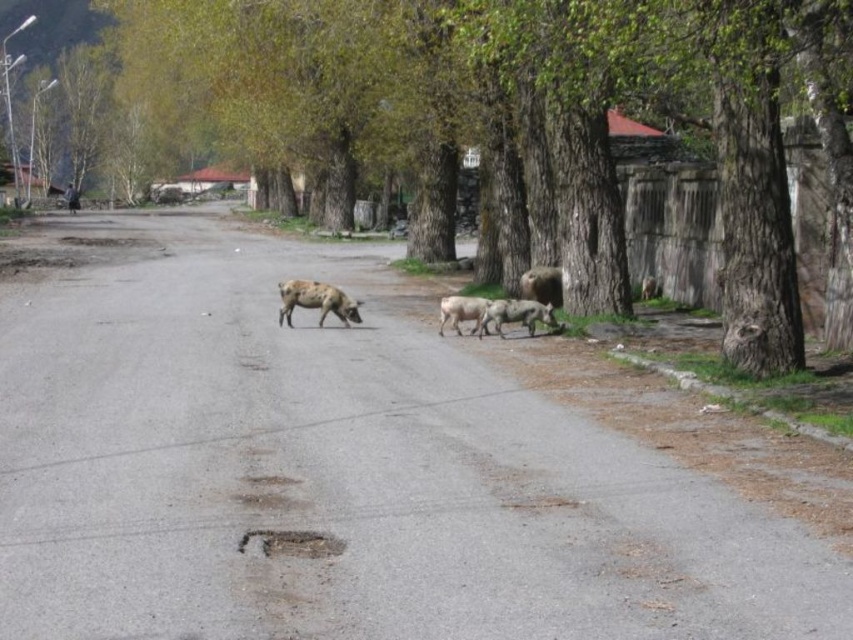
You are a farmer who needs to move the brown woolen sheep at right to the brown rough tree at center for a photo shoot. Given that your tractor can only tow objects up to 50 feet, will you be able to tow the sheep the required distance?

The distance between the brown rough tree at center and the brown woolen sheep at right is 50.28 feet, which exceeds the tractor towing limit of 50 feet. Therefore, the tractor cannot tow the sheep the required distance.

You are standing on the rural street and want to walk from point (584, 112) to point (532, 317). Which direction should you face to move towards the latter point?

Since point (584, 112) is closer to you than point 0.498, 0265, you should face away from the trees to move towards the latter point.